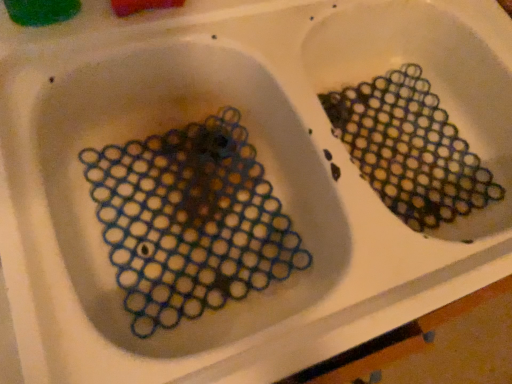
Question: Is translucent plastic mesh at upper right, the second debris in the left-to-right sequence, to the left or to the right of translucent plastic mesh at left, marked as the 1th debris in a left-to-right arrangement, in the image?

Choices:
 (A) left
 (B) right

Answer: (B)

Question: Is translucent plastic mesh at upper right, the second debris in the left-to-right sequence, wider or thinner than translucent plastic mesh at left, marked as the 1th debris in a left-to-right arrangement?

Choices:
 (A) thin
 (B) wide

Answer: (A)

Question: From the image's perspective, is translucent plastic mesh at upper right, the second debris in the left-to-right sequence, positioned above or below translucent plastic mesh at left, the second debris when ordered from right to left?

Choices:
 (A) above
 (B) below

Answer: (A)

Question: From the image's perspective, is translucent plastic mesh at left, the second debris when ordered from right to left, positioned above or below translucent plastic mesh at upper right, the first debris in the right-to-left sequence?

Choices:
 (A) above
 (B) below

Answer: (B)

Question: Considering the positions of translucent plastic mesh at left, marked as the 1th debris in a left-to-right arrangement, and translucent plastic mesh at upper right, the second debris in the left-to-right sequence, in the image, is translucent plastic mesh at left, marked as the 1th debris in a left-to-right arrangement, bigger or smaller than translucent plastic mesh at upper right, the second debris in the left-to-right sequence,?

Choices:
 (A) big
 (B) small

Answer: (A)

Question: From a real-world perspective, relative to translucent plastic mesh at upper right, the second debris in the left-to-right sequence, is translucent plastic mesh at left, marked as the 1th debris in a left-to-right arrangement, vertically above or below?

Choices:
 (A) below
 (B) above

Answer: (B)

Question: Is translucent plastic mesh at left, marked as the 1th debris in a left-to-right arrangement, in front of or behind translucent plastic mesh at upper right, the first debris in the right-to-left sequence, in the image?

Choices:
 (A) front
 (B) behind

Answer: (A)